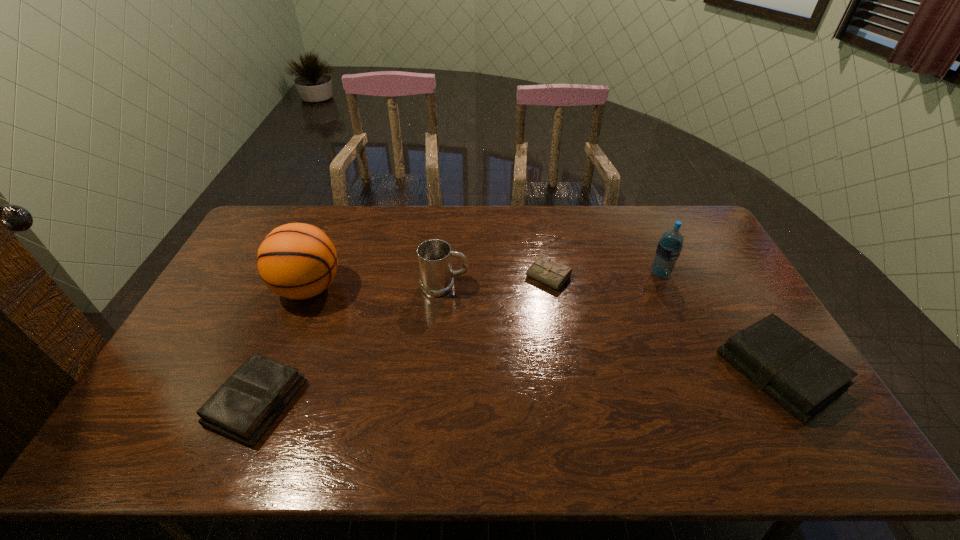
Identify the location of the second shortest object. (245, 406).

This screenshot has width=960, height=540. I want to click on the shorter book, so click(x=245, y=406).

Locate an element on the screen. This screenshot has width=960, height=540. the fourth tallest object is located at coordinates (803, 378).

This screenshot has width=960, height=540. What are the coordinates of `the taller book` in the screenshot? It's located at (803, 378).

Where is `the fifth object from left to right`? the fifth object from left to right is located at coordinates (669, 247).

Where is `basketball`? The image size is (960, 540). basketball is located at coordinates (297, 261).

The width and height of the screenshot is (960, 540). Identify the location of diary. (543, 270).

Image resolution: width=960 pixels, height=540 pixels. In order to click on the shortest object in this screenshot , I will do tap(543, 270).

The image size is (960, 540). Identify the location of the third object from left to right. (434, 256).

Where is `the third tallest object`? the third tallest object is located at coordinates (434, 256).